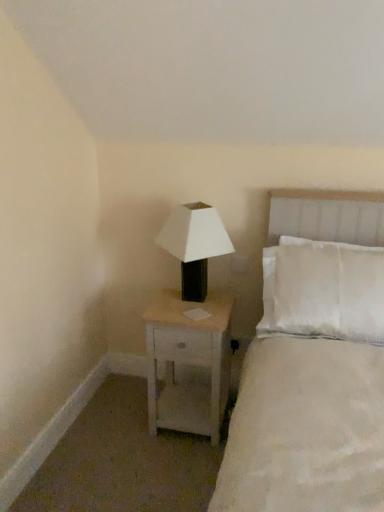
Question: Is white wood nightstand at center in front of white matte/black plastic lamp at upper right?

Choices:
 (A) no
 (B) yes

Answer: (A)

Question: From a real-world perspective, does white wood nightstand at center sit lower than white matte/black plastic lamp at upper right?

Choices:
 (A) no
 (B) yes

Answer: (B)

Question: Is white wood nightstand at center facing away from white matte/black plastic lamp at upper right?

Choices:
 (A) no
 (B) yes

Answer: (A)

Question: Is white wood nightstand at center smaller than white matte/black plastic lamp at upper right?

Choices:
 (A) no
 (B) yes

Answer: (A)

Question: Is white wood nightstand at center shorter than white matte/black plastic lamp at upper right?

Choices:
 (A) yes
 (B) no

Answer: (B)

Question: Can you confirm if white wood nightstand at center is taller than white matte/black plastic lamp at upper right?

Choices:
 (A) yes
 (B) no

Answer: (A)

Question: Is the position of white wood nightstand at center more distant than that of white soft bed at upper right?

Choices:
 (A) yes
 (B) no

Answer: (A)

Question: Is white wood nightstand at center closer to camera compared to white soft bed at upper right?

Choices:
 (A) no
 (B) yes

Answer: (A)

Question: Can you see white wood nightstand at center touching white soft bed at upper right?

Choices:
 (A) no
 (B) yes

Answer: (A)

Question: Does white wood nightstand at center have a lesser height compared to white soft bed at upper right?

Choices:
 (A) no
 (B) yes

Answer: (B)

Question: Does white wood nightstand at center appear on the right side of white soft bed at upper right?

Choices:
 (A) no
 (B) yes

Answer: (A)

Question: Considering the relative sizes of white wood nightstand at center and white soft bed at upper right in the image provided, is white wood nightstand at center bigger than white soft bed at upper right?

Choices:
 (A) no
 (B) yes

Answer: (A)

Question: From the image's perspective, would you say white matte/black plastic lamp at upper right is positioned over white wood nightstand at center?

Choices:
 (A) no
 (B) yes

Answer: (B)